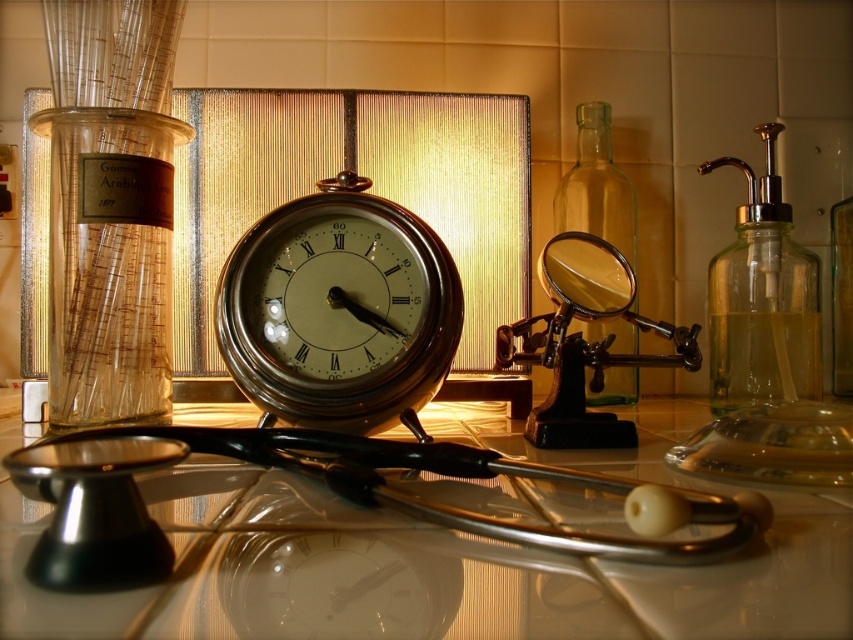
Which is below, transparent glass cylinder at left or clear glass soap dispenser at right?

transparent glass cylinder at left is lower down.

Consider the image. Between transparent glass cylinder at left and clear glass soap dispenser at right, which one has less height?

transparent glass cylinder at left

The width and height of the screenshot is (853, 640). Identify the location of transparent glass cylinder at left. (109, 260).

Does clear glass soap dispenser at right have a larger size compared to transparent glass bottle at center-right?

No, clear glass soap dispenser at right is not bigger than transparent glass bottle at center-right.

Can you confirm if clear glass soap dispenser at right is wider than transparent glass bottle at center-right?

Correct, the width of clear glass soap dispenser at right exceeds that of transparent glass bottle at center-right.

Describe the element at coordinates (762, 298) in the screenshot. I see `clear glass soap dispenser at right` at that location.

This screenshot has height=640, width=853. What are the coordinates of `clear glass soap dispenser at right` in the screenshot? It's located at (762, 298).

Is point (383, 200) behind point (65, 285)?

No.

Between shiny brass clock at center and transparent glass cylinder at left, which one has more height?

transparent glass cylinder at left

Is point (445, 368) more distant than point (80, 189)?

No, it is not.

Locate an element on the screen. Image resolution: width=853 pixels, height=640 pixels. shiny brass clock at center is located at coordinates (339, 310).